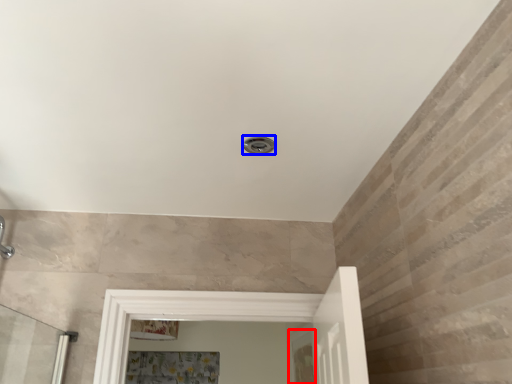
Question: Among these objects, which one is farthest to the camera, screen door (highlighted by a red box) or shower (highlighted by a blue box)?

Choices:
 (A) screen door
 (B) shower

Answer: (A)